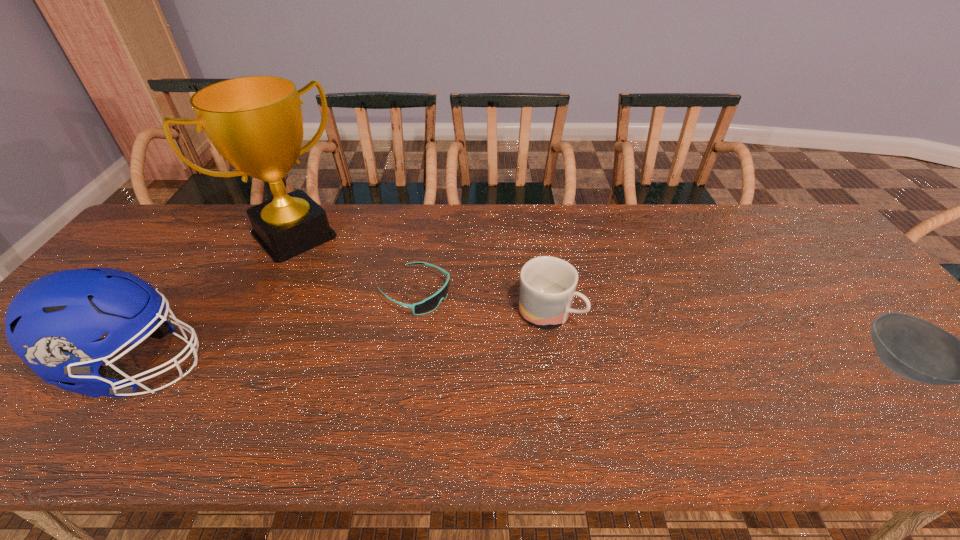
Locate an element on the screen. object that is positioned at the near left corner is located at coordinates (54, 324).

In the image, there is a desktop. In order to click on vacant region at the far edge in this screenshot , I will do `click(396, 242)`.

Identify the location of free space at the near edge of the desktop. The image size is (960, 540). (595, 383).

At what (x,y) coordinates should I click in order to perform the action: click on vacant space at the right edge. Please return your answer as a coordinate pair (x, y). Looking at the image, I should click on (804, 259).

Where is `free spot at the far left corner of the desktop`? This screenshot has height=540, width=960. free spot at the far left corner of the desktop is located at coordinates (201, 209).

At what (x,y) coordinates should I click in order to perform the action: click on blank space at the near left corner. Please return your answer as a coordinate pair (x, y). Looking at the image, I should click on (8, 386).

This screenshot has height=540, width=960. Find the location of `free space between the third object from left to right and the award`. free space between the third object from left to right and the award is located at coordinates (354, 264).

The width and height of the screenshot is (960, 540). What are the coordinates of `empty space between the football helmet and the award` in the screenshot? It's located at (217, 301).

Identify the location of vacant area that lies between the farthest object and the second tallest object. This screenshot has width=960, height=540. (217, 301).

Find the location of a particular element. The image size is (960, 540). empty location between the second object from right to left and the football helmet is located at coordinates (344, 340).